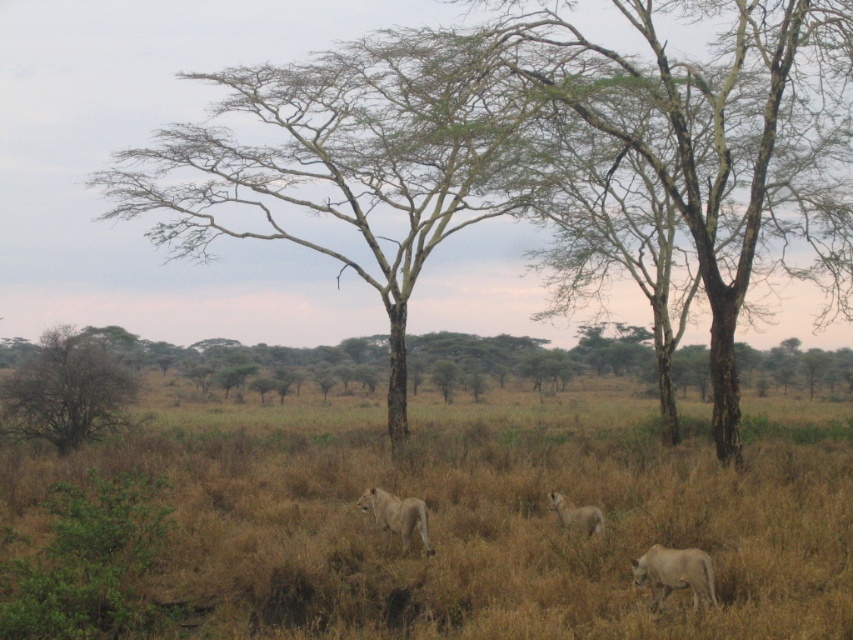
Question: Which object appears farthest from the camera in this image?

Choices:
 (A) brown/dry grass at left
 (B) golden fur lion at lower right

Answer: (A)

Question: Does brown/dry grass at left appear on the left side of light brown fur lion at center?

Choices:
 (A) no
 (B) yes

Answer: (B)

Question: Which object is the closest to the golden fur lion at lower right?

Choices:
 (A) light brown fur lion at center
 (B) golden fur lion at center

Answer: (A)

Question: Based on their relative distances, which object is nearer to the golden fur lion at center?

Choices:
 (A) light brown fur lion at center
 (B) brown/dry grass at left
 (C) golden fur lion at lower right

Answer: (A)

Question: Is brown/dry grass at left smaller than light brown fur lion at center?

Choices:
 (A) yes
 (B) no

Answer: (B)

Question: Is golden fur lion at lower right to the left of golden fur lion at center from the viewer's perspective?

Choices:
 (A) yes
 (B) no

Answer: (B)